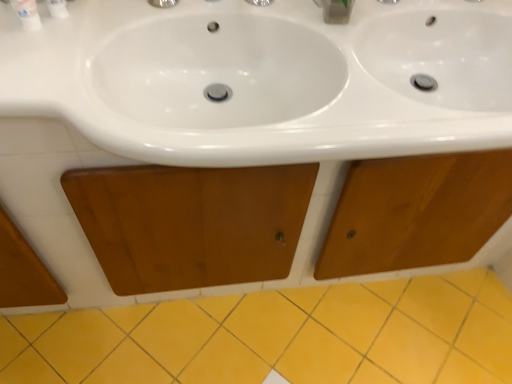
Question: From the image's perspective, is yellow ceramic tile at lower center below wooden cabinet at center?

Choices:
 (A) no
 (B) yes

Answer: (B)

Question: Considering the relative positions of yellow ceramic tile at lower center and wooden cabinet at center in the image provided, is yellow ceramic tile at lower center to the left of wooden cabinet at center from the viewer's perspective?

Choices:
 (A) no
 (B) yes

Answer: (A)

Question: Does yellow ceramic tile at lower center have a greater width compared to wooden cabinet at center?

Choices:
 (A) no
 (B) yes

Answer: (B)

Question: From a real-world perspective, is yellow ceramic tile at lower center under wooden cabinet at center?

Choices:
 (A) yes
 (B) no

Answer: (A)

Question: Is wooden cabinet at center located within yellow ceramic tile at lower center?

Choices:
 (A) no
 (B) yes

Answer: (A)

Question: Is yellow ceramic tile at lower center positioned far away from wooden cabinet at center?

Choices:
 (A) yes
 (B) no

Answer: (B)

Question: Is clear plastic container at upper center to the right of wooden cabinet at center from the viewer's perspective?

Choices:
 (A) no
 (B) yes

Answer: (B)

Question: From a real-world perspective, is clear plastic container at upper center physically below wooden cabinet at center?

Choices:
 (A) no
 (B) yes

Answer: (A)

Question: Does clear plastic container at upper center have a larger size compared to wooden cabinet at center?

Choices:
 (A) no
 (B) yes

Answer: (A)

Question: Is clear plastic container at upper center not within wooden cabinet at center?

Choices:
 (A) yes
 (B) no

Answer: (A)

Question: From the image's perspective, is clear plastic container at upper center above wooden cabinet at center?

Choices:
 (A) no
 (B) yes

Answer: (B)

Question: Is clear plastic container at upper center looking in the opposite direction of wooden cabinet at center?

Choices:
 (A) yes
 (B) no

Answer: (B)

Question: Does white glossy bottle at upper left turn towards wooden cabinet at center?

Choices:
 (A) no
 (B) yes

Answer: (A)